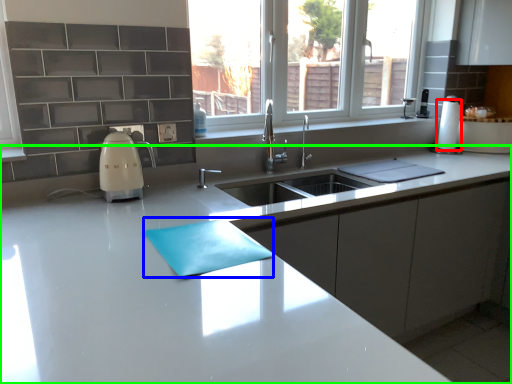
Question: Considering the real-world distances, which object is farthest from paper towel (highlighted by a red box)? place mat (highlighted by a blue box) or countertop (highlighted by a green box)?

Choices:
 (A) place mat
 (B) countertop

Answer: (A)